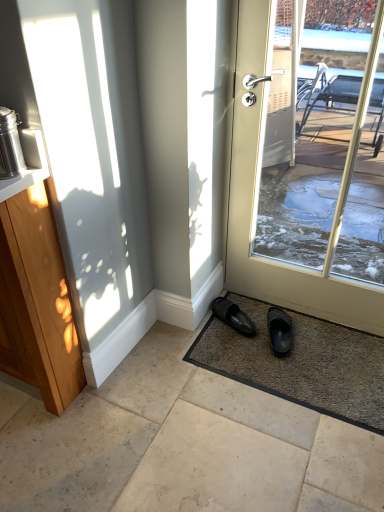
Question: Does wooden cabinet at left come behind smooth beige tiles at center?

Choices:
 (A) no
 (B) yes

Answer: (B)

Question: Considering the relative sizes of wooden cabinet at left and smooth beige tiles at center in the image provided, is wooden cabinet at left taller than smooth beige tiles at center?

Choices:
 (A) no
 (B) yes

Answer: (B)

Question: Is the surface of wooden cabinet at left in direct contact with smooth beige tiles at center?

Choices:
 (A) no
 (B) yes

Answer: (A)

Question: Is wooden cabinet at left positioned in front of smooth beige tiles at center?

Choices:
 (A) yes
 (B) no

Answer: (B)

Question: From a real-world perspective, does wooden cabinet at left sit lower than smooth beige tiles at center?

Choices:
 (A) yes
 (B) no

Answer: (B)

Question: Considering the relative sizes of wooden cabinet at left and smooth beige tiles at center in the image provided, is wooden cabinet at left bigger than smooth beige tiles at center?

Choices:
 (A) no
 (B) yes

Answer: (B)

Question: Can you confirm if black rubber slipper at lower center, marked as the first footwear in a left-to-right arrangement, is bigger than matte white door at center?

Choices:
 (A) no
 (B) yes

Answer: (A)

Question: Does black rubber slipper at lower center, the 2th footwear when ordered from right to left, appear on the right side of matte white door at center?

Choices:
 (A) yes
 (B) no

Answer: (B)

Question: Does black rubber slipper at lower center, the 2th footwear when ordered from right to left, have a greater width compared to matte white door at center?

Choices:
 (A) no
 (B) yes

Answer: (B)

Question: Does black rubber slipper at lower center, the 2th footwear when ordered from right to left, have a greater height compared to matte white door at center?

Choices:
 (A) yes
 (B) no

Answer: (B)

Question: Is the depth of black rubber slipper at lower center, the 2th footwear when ordered from right to left, less than that of matte white door at center?

Choices:
 (A) no
 (B) yes

Answer: (A)

Question: From the image's perspective, would you say black rubber slipper at lower center, the 2th footwear when ordered from right to left, is positioned over matte white door at center?

Choices:
 (A) no
 (B) yes

Answer: (A)

Question: Is stainless steel thermos at left smaller than matte white door at center?

Choices:
 (A) no
 (B) yes

Answer: (B)